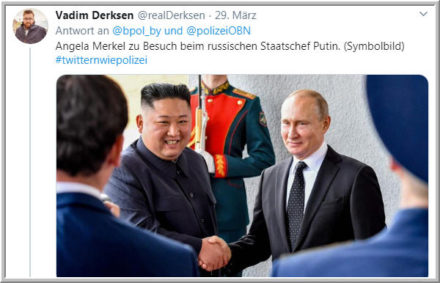
You are a GUI agent. You are given a task and a screenshot of the screen. Output one action in this format:
    pyautogui.click(x=<x>, y=<y>)
    Task: Click on the wall
    
    Given the screenshot: What is the action you would take?
    pyautogui.click(x=357, y=138)